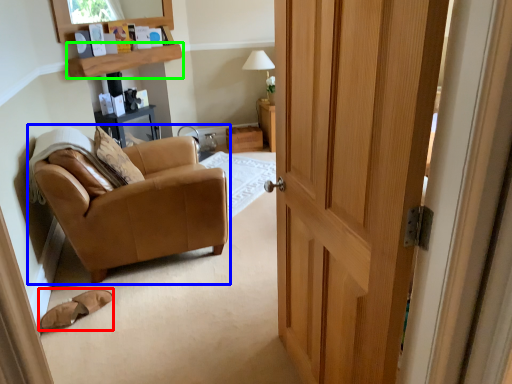
Question: Which object is the closest to the footwear (highlighted by a red box)? Choose among these: chair (highlighted by a blue box) or shelf (highlighted by a green box).

Choices:
 (A) chair
 (B) shelf

Answer: (A)